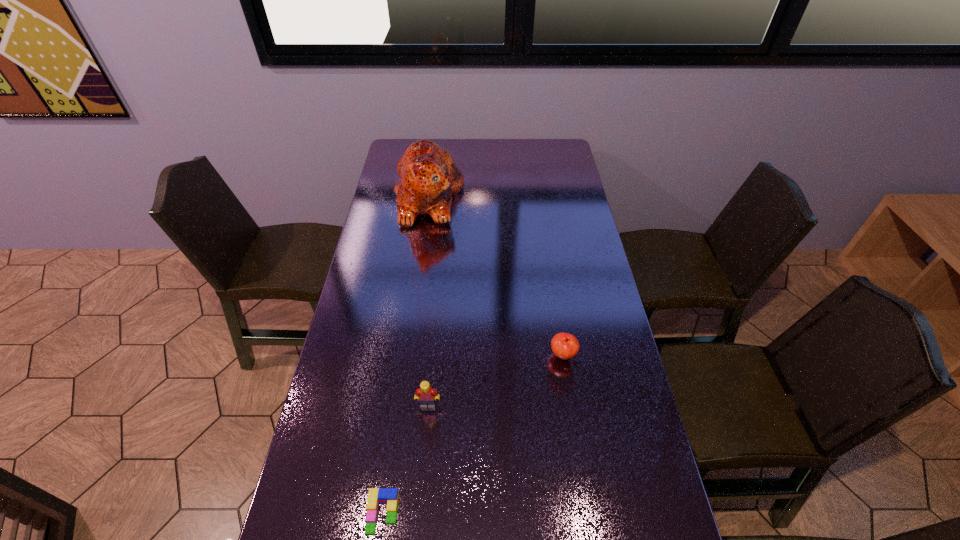
Image resolution: width=960 pixels, height=540 pixels. Find the location of `vacant space that satisfies the following two spatial constraints: 1. on the face of the third tallest object; 2. on the left side of the tallest object`. vacant space that satisfies the following two spatial constraints: 1. on the face of the third tallest object; 2. on the left side of the tallest object is located at coordinates (407, 355).